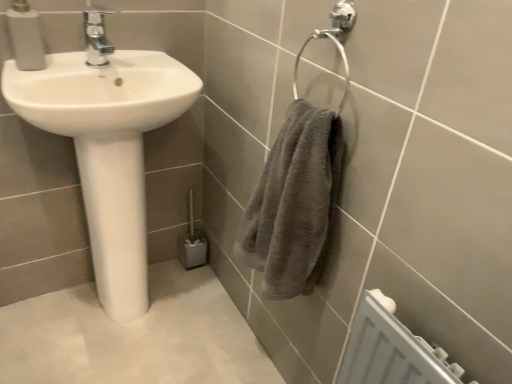
Find the location of a particular element. free area in between matte white soap dispenser at upper left and chrome metallic faucet at upper center is located at coordinates (67, 63).